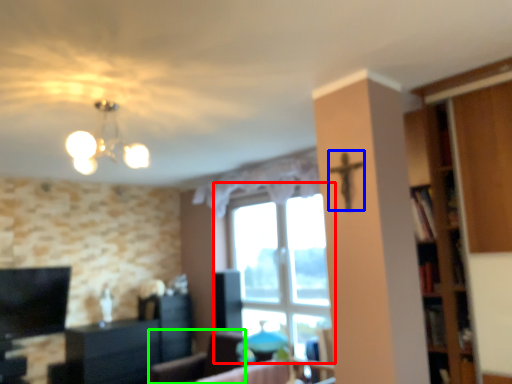
Question: Considering the real-world distances, which object is closest to window (highlighted by a red box)? crucifix (highlighted by a blue box) or furniture (highlighted by a green box).

Choices:
 (A) crucifix
 (B) furniture

Answer: (B)